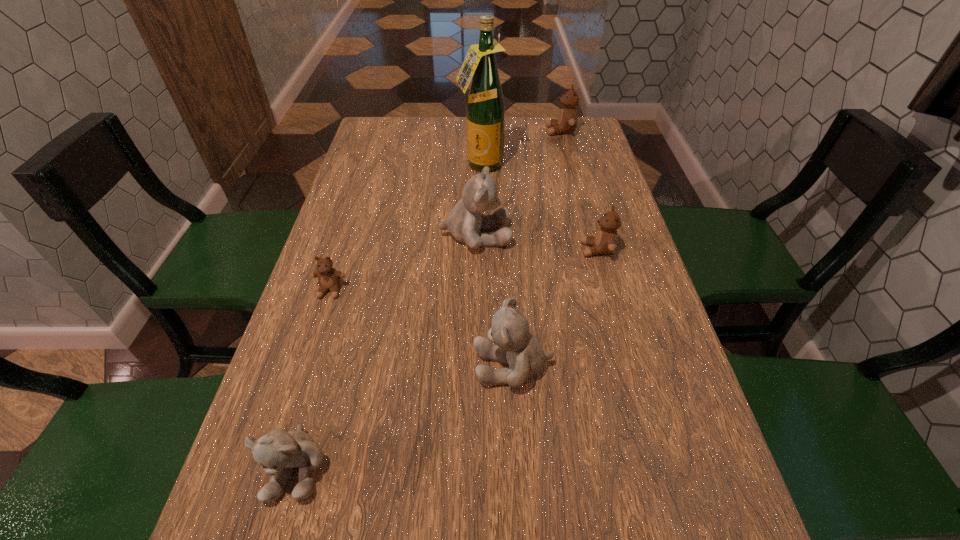
In the image, there is a desktop. In order to click on blank space at the far left corner in this screenshot , I will do `click(407, 119)`.

In the image, there is a desktop. At what (x,y) coordinates should I click in order to perform the action: click on vacant space at the far right corner. Please return your answer as a coordinate pair (x, y). This screenshot has height=540, width=960. Looking at the image, I should click on (581, 153).

Locate an element on the screen. The image size is (960, 540). free space between the fourth farthest teddy bear and the second farthest gray teddy bear is located at coordinates (421, 328).

Where is `empty space between the farthest teddy bear and the second nearest brown teddy bear`? The image size is (960, 540). empty space between the farthest teddy bear and the second nearest brown teddy bear is located at coordinates (579, 190).

At what (x,y) coordinates should I click in order to perform the action: click on free point between the farthest gray teddy bear and the third nearest object. Please return your answer as a coordinate pair (x, y). Image resolution: width=960 pixels, height=540 pixels. Looking at the image, I should click on pyautogui.click(x=403, y=263).

The height and width of the screenshot is (540, 960). Find the location of `empty location between the farthest teddy bear and the second smallest gray teddy bear`. empty location between the farthest teddy bear and the second smallest gray teddy bear is located at coordinates (537, 248).

You are a GUI agent. You are given a task and a screenshot of the screen. Output one action in this format:
    pyautogui.click(x=<x>, y=<y>)
    Task: Click on the object that is the sixth closest to the second nearest brown teddy bear
    The height and width of the screenshot is (540, 960).
    Given the screenshot: What is the action you would take?
    pyautogui.click(x=277, y=451)

This screenshot has width=960, height=540. Find the location of `object that is the sixth closest to the farthest teddy bear`. object that is the sixth closest to the farthest teddy bear is located at coordinates (277, 451).

The image size is (960, 540). I want to click on the second closest teddy bear relative to the second smallest brown teddy bear, so click(514, 345).

Where is `teddy bear that is the third nearest to the second nearest gray teddy bear`? Image resolution: width=960 pixels, height=540 pixels. teddy bear that is the third nearest to the second nearest gray teddy bear is located at coordinates (277, 451).